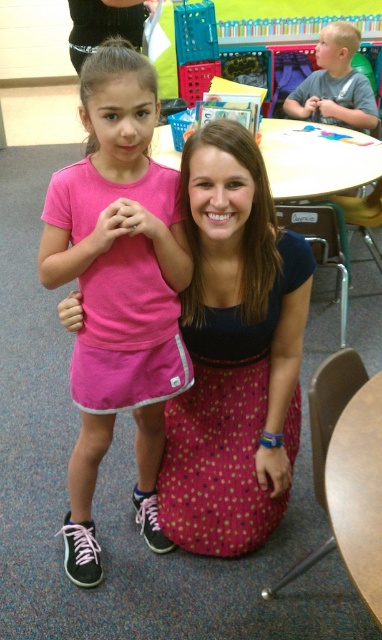
Question: Considering the relative positions of pink fabric skirt at center and pink dotted fabric dress at center in the image provided, where is pink fabric skirt at center located with respect to pink dotted fabric dress at center?

Choices:
 (A) above
 (B) below

Answer: (A)

Question: Which point is closer to the camera taking this photo?

Choices:
 (A) (80, 36)
 (B) (309, 83)

Answer: (A)

Question: Can you confirm if blonde hair boy at upper right is bigger than black hair at upper left?

Choices:
 (A) no
 (B) yes

Answer: (A)

Question: Does pink fabric skirt at center appear over pink dotted fabric dress at center?

Choices:
 (A) no
 (B) yes

Answer: (B)

Question: Which of the following is the farthest from the observer?

Choices:
 (A) (202, 416)
 (B) (108, 122)

Answer: (A)

Question: Among these objects, which one is nearest to the camera?

Choices:
 (A) blonde hair boy at upper right
 (B) pink dotted fabric dress at center
 (C) black hair at upper left

Answer: (B)